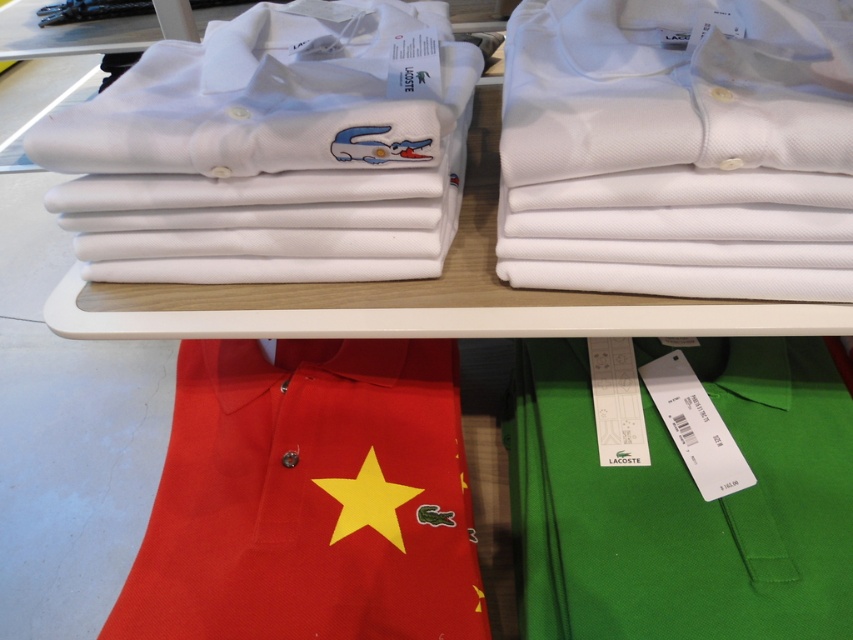
Question: Which point is farther from the camera taking this photo?

Choices:
 (A) (132, 577)
 (B) (660, 560)

Answer: (A)

Question: Does white cotton shirt at upper left appear on the right side of red cotton polo shirt at lower left?

Choices:
 (A) yes
 (B) no

Answer: (A)

Question: Among these objects, which one is nearest to the camera?

Choices:
 (A) green cotton polo shirt at lower right
 (B) white cotton shirt at upper left
 (C) white cotton shirt at upper center

Answer: (C)

Question: Which of the following is the farthest from the observer?

Choices:
 (A) green cotton polo shirt at lower right
 (B) red cotton polo shirt at lower left
 (C) white cotton shirt at upper left

Answer: (B)

Question: Is the position of red cotton polo shirt at lower left less distant than that of green cotton polo shirt at lower right?

Choices:
 (A) no
 (B) yes

Answer: (A)

Question: Does white cotton shirt at upper center appear under red cotton polo shirt at lower left?

Choices:
 (A) yes
 (B) no

Answer: (B)